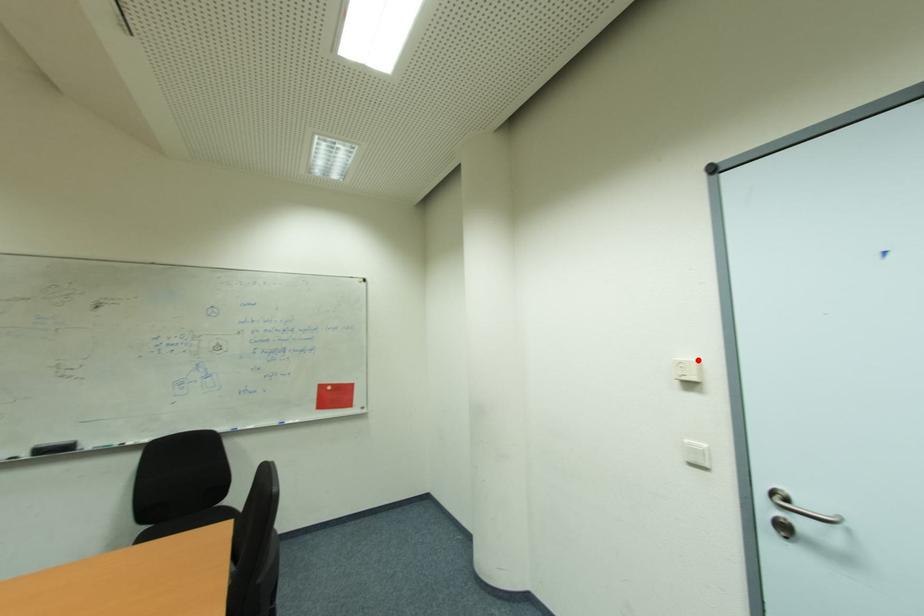
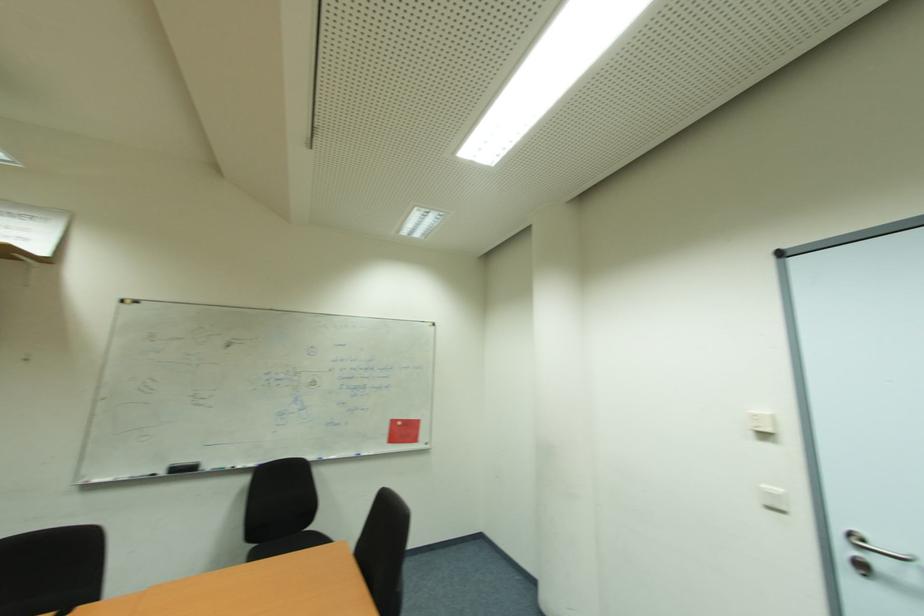
Where in the second image is the point corresponding to the highlighted location from the first image?

(771, 414)